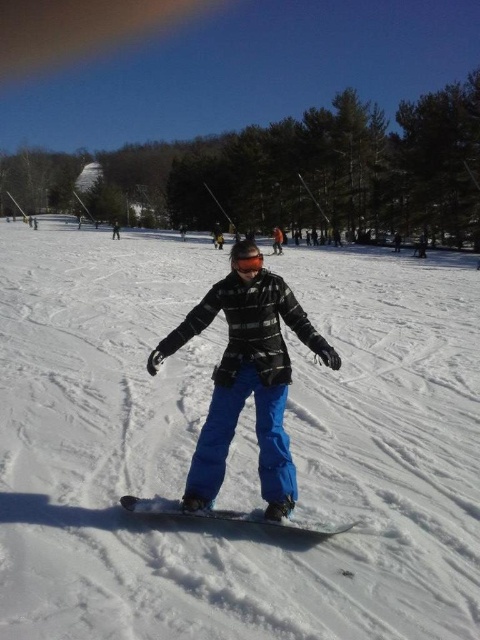
How far apart are matte black snowboarder at center and black matte goggles at center?

The distance of matte black snowboarder at center from black matte goggles at center is 1.32 meters.

Does matte black snowboarder at center lie in front of black matte goggles at center?

No, it is not.

Is point (240, 292) positioned after point (231, 259)?

No.

I want to click on matte black snowboarder at center, so click(247, 381).

Is point (156, 356) in front of point (152, 506)?

No, it is behind (152, 506).

Is point (148, 358) closer to camera compared to point (283, 525)?

No, (148, 358) is behind (283, 525).

Identify the location of matte black snowboarder at center. This screenshot has width=480, height=640. (247, 381).

From the picture: Who is lower down, black matte snowboard at center or black matte goggles at center?

black matte snowboard at center

Does black matte snowboard at center have a lesser width compared to black matte goggles at center?

No.

Which is in front, point (256, 522) or point (238, 256)?

Positioned in front is point (256, 522).

The width and height of the screenshot is (480, 640). I want to click on black matte snowboard at center, so click(228, 515).